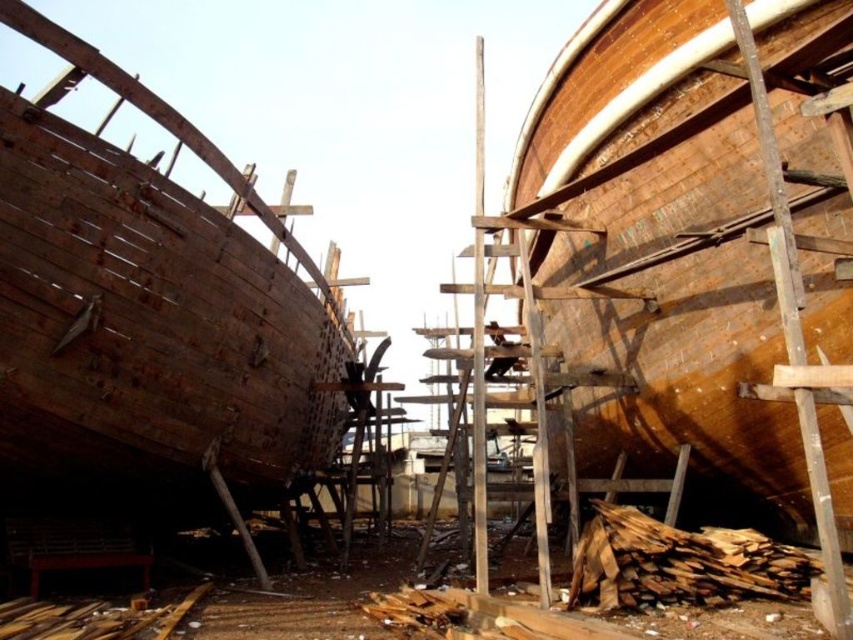
Which is behind, point (231, 228) or point (703, 602)?

Positioned behind is point (231, 228).

Between rusty wood boat at left and wooden planks at lower right, which one appears on the left side from the viewer's perspective?

From the viewer's perspective, rusty wood boat at left appears more on the left side.

Between point (33, 417) and point (641, 534), which one is positioned behind?

Positioned behind is point (641, 534).

You are a GUI agent. You are given a task and a screenshot of the screen. Output one action in this format:
    pyautogui.click(x=<x>, y=<y>)
    Task: Click on the rusty wood boat at left
    The image size is (853, 640).
    Given the screenshot: What is the action you would take?
    pyautogui.click(x=149, y=305)